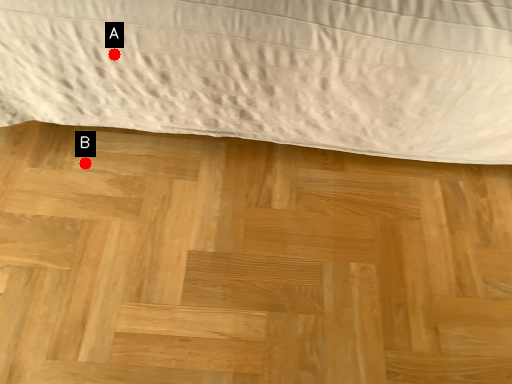
Question: Two points are circled on the image, labeled by A and B beside each circle. Which point is farther from the camera taking this photo?

Choices:
 (A) A is further
 (B) B is further

Answer: (B)